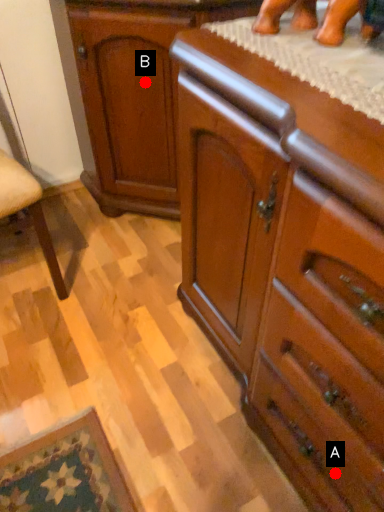
Question: Two points are circled on the image, labeled by A and B beside each circle. Among these points, which one is farthest from the camera?

Choices:
 (A) A is further
 (B) B is further

Answer: (B)